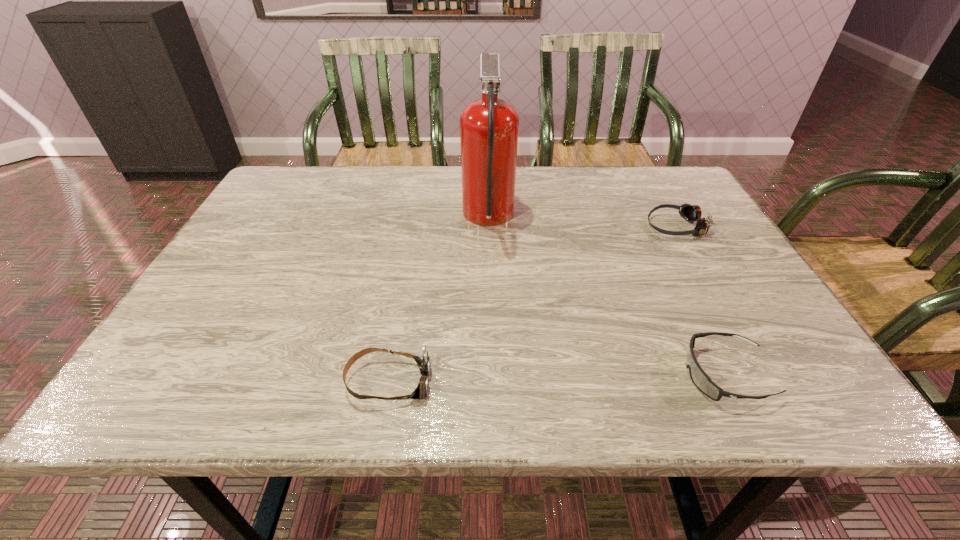
Where is `the second object from left to right`? This screenshot has height=540, width=960. the second object from left to right is located at coordinates coord(489,126).

Locate an element on the screen. fire extinguisher is located at coordinates (489, 126).

You are a GUI agent. You are given a task and a screenshot of the screen. Output one action in this format:
    pyautogui.click(x=<x>, y=<y>)
    Task: Click on the farthest goggles
    
    Given the screenshot: What is the action you would take?
    [691, 213]

The image size is (960, 540). Identify the location of the leftmost goggles. (423, 361).

Locate an element on the screen. This screenshot has height=540, width=960. blank space located 0.260m with the handle and nozzle on the tallest object is located at coordinates (364, 218).

The image size is (960, 540). I want to click on vacant space located with the handle and nozzle on the tallest object, so 413,218.

Locate an element on the screen. The width and height of the screenshot is (960, 540). vacant space situated with the handle and nozzle on the tallest object is located at coordinates (424, 218).

The height and width of the screenshot is (540, 960). I want to click on vacant space located through the lenses of the farthest goggles, so click(x=528, y=226).

Find the location of `vacant space situated 0.130m through the lenses of the farthest goggles`. vacant space situated 0.130m through the lenses of the farthest goggles is located at coordinates (597, 226).

At what (x,y) coordinates should I click in order to perform the action: click on vacant space situated through the lenses of the farthest goggles. Please return your answer as a coordinate pair (x, y). The image size is (960, 540). Looking at the image, I should click on (523, 226).